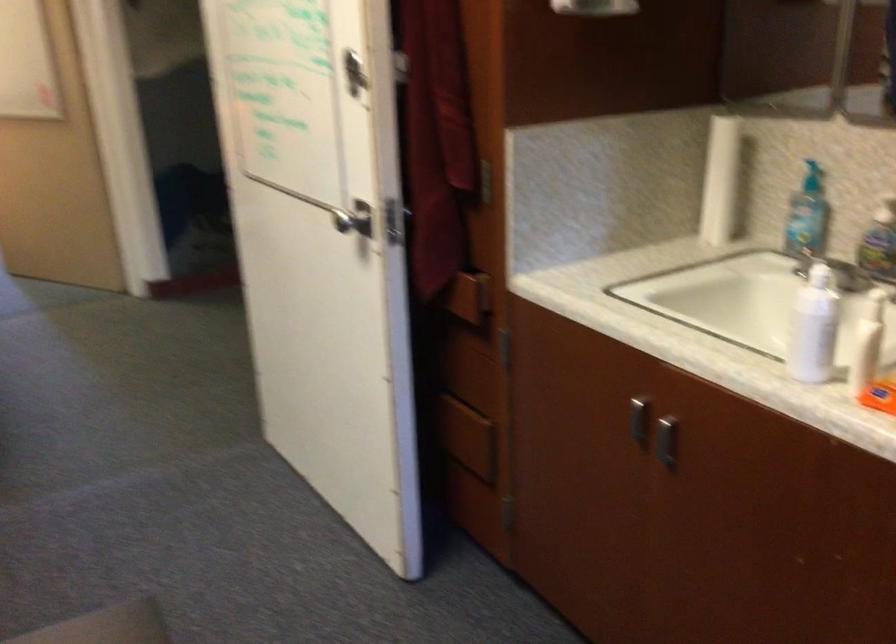
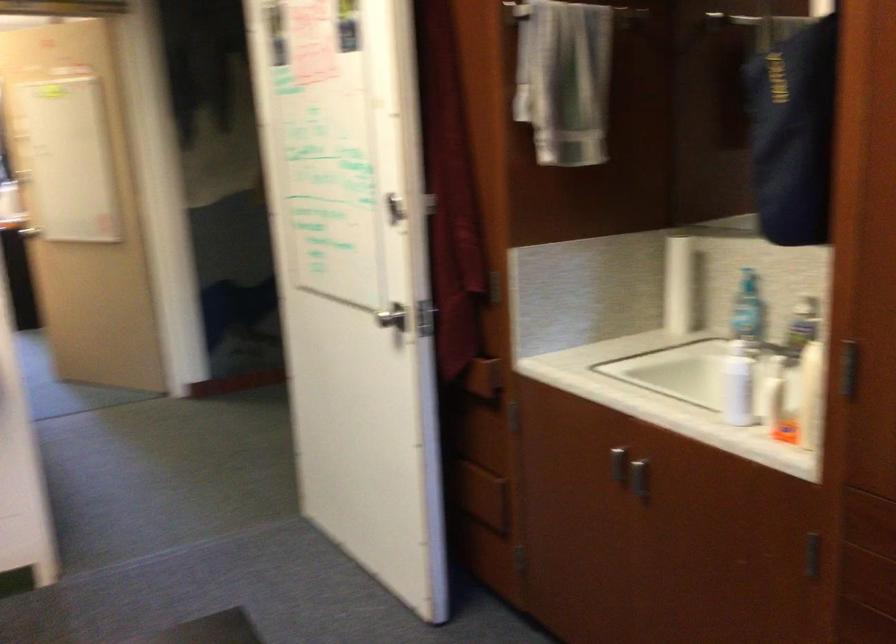
The point at (x=469, y=297) is marked in the first image. Where is the corresponding point in the second image?

(485, 377)